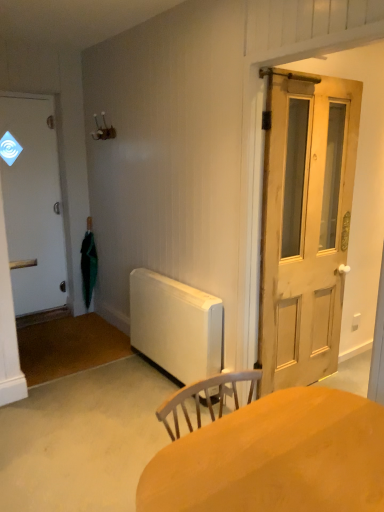
Locate an element on the screen. This screenshot has height=512, width=384. free space above white matte radiator at center (from a real-world perspective) is located at coordinates (172, 284).